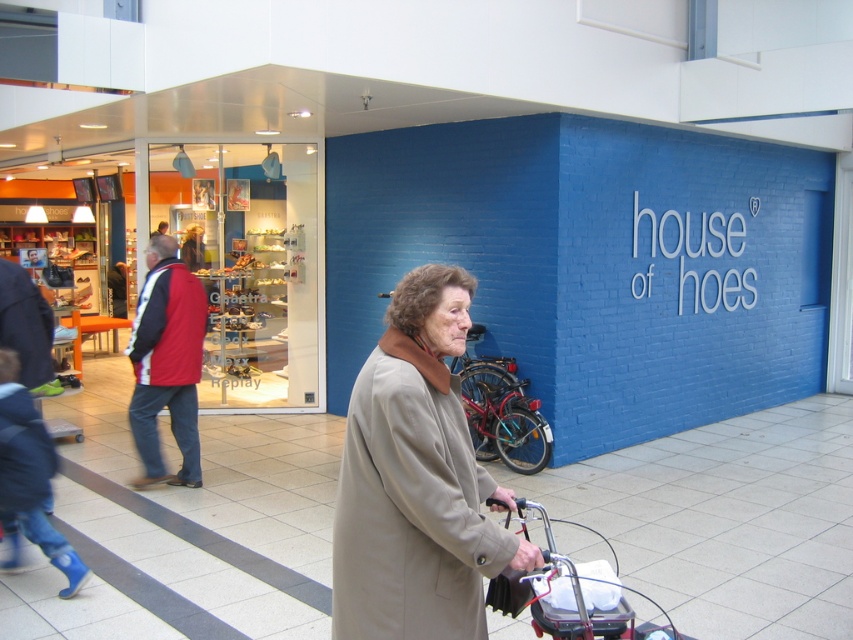
Question: Among these points, which one is nearest to the camera?

Choices:
 (A) (157, 294)
 (B) (486, 596)
 (C) (350, 604)

Answer: (C)

Question: Is beige wool coat at center closer to camera compared to red jacket at left?

Choices:
 (A) yes
 (B) no

Answer: (A)

Question: Can you confirm if matte glass shoe display at left is thinner than beige wool coat at center?

Choices:
 (A) no
 (B) yes

Answer: (A)

Question: Which point appears closest to the camera in this image?

Choices:
 (A) (376, 387)
 (B) (161, 340)

Answer: (A)

Question: Which of these objects is positioned farthest from the metallic silver baby carriage at lower center?

Choices:
 (A) beige wool coat at center
 (B) red jacket at left

Answer: (B)

Question: Observing the image, what is the correct spatial positioning of matte glass shoe display at left in reference to beige wool coat at center?

Choices:
 (A) left
 (B) right

Answer: (A)